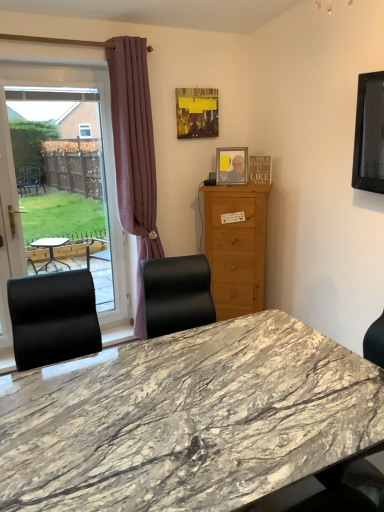
Question: From the image's perspective, does light brown wood cabinet at center appear lower than transparent glass window at left?

Choices:
 (A) no
 (B) yes

Answer: (B)

Question: From a real-world perspective, does light brown wood cabinet at center stand above transparent glass window at left?

Choices:
 (A) yes
 (B) no

Answer: (B)

Question: Can you confirm if light brown wood cabinet at center is positioned to the left of transparent glass window at left?

Choices:
 (A) yes
 (B) no

Answer: (B)

Question: Can you confirm if light brown wood cabinet at center is taller than transparent glass window at left?

Choices:
 (A) no
 (B) yes

Answer: (A)

Question: Can you confirm if light brown wood cabinet at center is wider than transparent glass window at left?

Choices:
 (A) no
 (B) yes

Answer: (B)

Question: Is light brown wood cabinet at center to the right of transparent glass window at left from the viewer's perspective?

Choices:
 (A) yes
 (B) no

Answer: (A)

Question: From a real-world perspective, is light brown wood cabinet at center physically above matte white screen door at left?

Choices:
 (A) no
 (B) yes

Answer: (A)

Question: Can we say light brown wood cabinet at center lies outside matte white screen door at left?

Choices:
 (A) yes
 (B) no

Answer: (A)

Question: Does light brown wood cabinet at center lie in front of matte white screen door at left?

Choices:
 (A) no
 (B) yes

Answer: (A)

Question: Considering the relative positions of light brown wood cabinet at center and matte white screen door at left in the image provided, is light brown wood cabinet at center to the right of matte white screen door at left from the viewer's perspective?

Choices:
 (A) yes
 (B) no

Answer: (A)

Question: Is light brown wood cabinet at center bigger than matte white screen door at left?

Choices:
 (A) no
 (B) yes

Answer: (B)

Question: From the image's perspective, would you say light brown wood cabinet at center is shown under matte white screen door at left?

Choices:
 (A) yes
 (B) no

Answer: (B)

Question: Can we say matte yellow picture frame at upper center, the first picture frame viewed from the top, lies outside light brown wood cabinet at center?

Choices:
 (A) yes
 (B) no

Answer: (A)